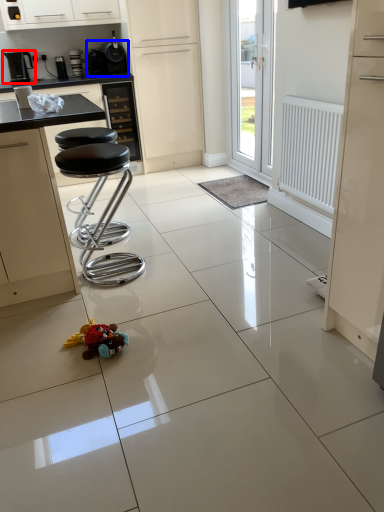
Question: Which object is closer to the camera taking this photo, coffee machine (highlighted by a red box) or appliance (highlighted by a blue box)?

Choices:
 (A) coffee machine
 (B) appliance

Answer: (B)